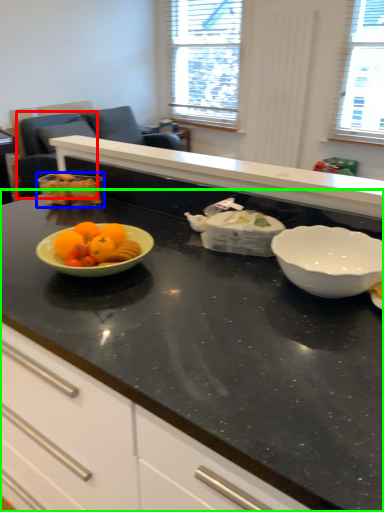
Question: Which is nearer to the armchair (highlighted by a red box)? tableware (highlighted by a blue box) or countertop (highlighted by a green box).

Choices:
 (A) tableware
 (B) countertop

Answer: (A)